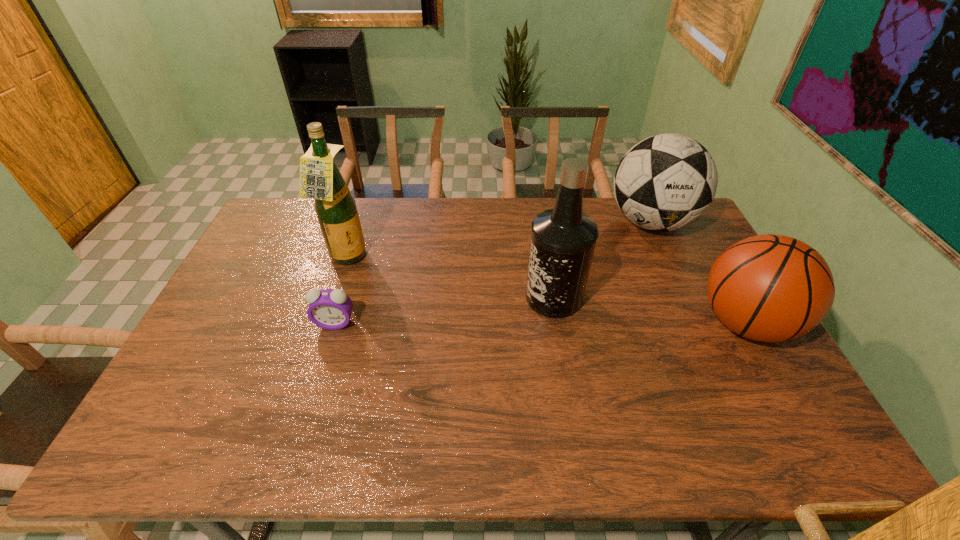
The width and height of the screenshot is (960, 540). What are the coordinates of `the shortest object` in the screenshot? It's located at (330, 309).

Locate an element on the screen. This screenshot has height=540, width=960. basketball is located at coordinates (772, 288).

Identify the location of the right liquor. (563, 239).

What are the coordinates of `the nearer liquor` in the screenshot? It's located at (563, 239).

Where is `the farther liquor`? The width and height of the screenshot is (960, 540). the farther liquor is located at coordinates (320, 179).

Locate an element on the screen. The image size is (960, 540). soccer ball is located at coordinates (665, 182).

Where is `vacant point located on the face of the shortest object`? This screenshot has height=540, width=960. vacant point located on the face of the shortest object is located at coordinates (314, 392).

This screenshot has width=960, height=540. Identify the location of vacant space located 0.080m on the back of the basketball. (715, 271).

At what (x,y) coordinates should I click in order to perform the action: click on vacant region located on the front label of the nearer liquor. Please return your answer as a coordinate pair (x, y). This screenshot has height=540, width=960. Looking at the image, I should click on (449, 345).

The image size is (960, 540). What are the coordinates of `blank space located 0.360m on the front label of the nearer liquor` in the screenshot? It's located at (420, 359).